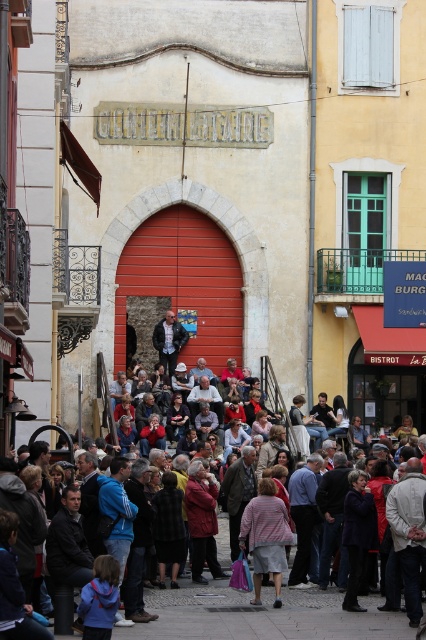
You are a photographer trying to capture a candid shot of the crowd in front of the red arched door. You notice two items of clothing at the center of the scene. Which one is wider, the striped fabric skirt at center or the black checkered jacket at center?

The striped fabric skirt at center might be wider than black checkered jacket at center.

You are standing in the street scene in front of the arched red door. There are two points marked in the image. Which point is closer to you, point (264, 557) or point (166, 552)?

Point (264, 557) is closer to the viewer than point (166, 552).